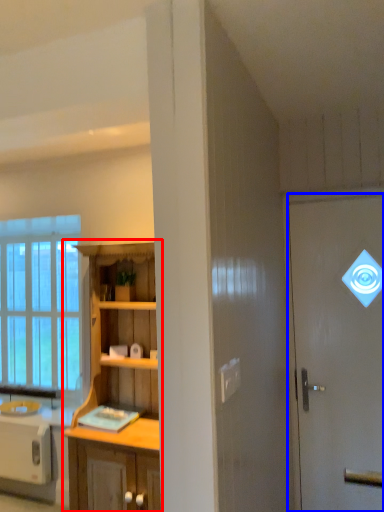
Question: Among these objects, which one is farthest to the camera, cabinetry (highlighted by a red box) or door (highlighted by a blue box)?

Choices:
 (A) cabinetry
 (B) door

Answer: (B)